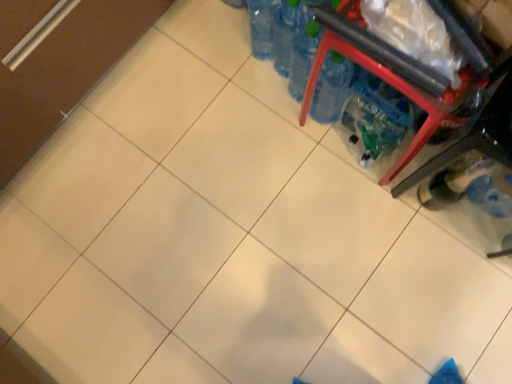
This screenshot has height=384, width=512. What do you see at coordinates (58, 63) in the screenshot?
I see `brown matte drawer at upper left` at bounding box center [58, 63].

Image resolution: width=512 pixels, height=384 pixels. In order to click on brown matte drawer at upper left in this screenshot , I will do [58, 63].

Where is `brown matte drawer at upper left`? brown matte drawer at upper left is located at coordinates (58, 63).